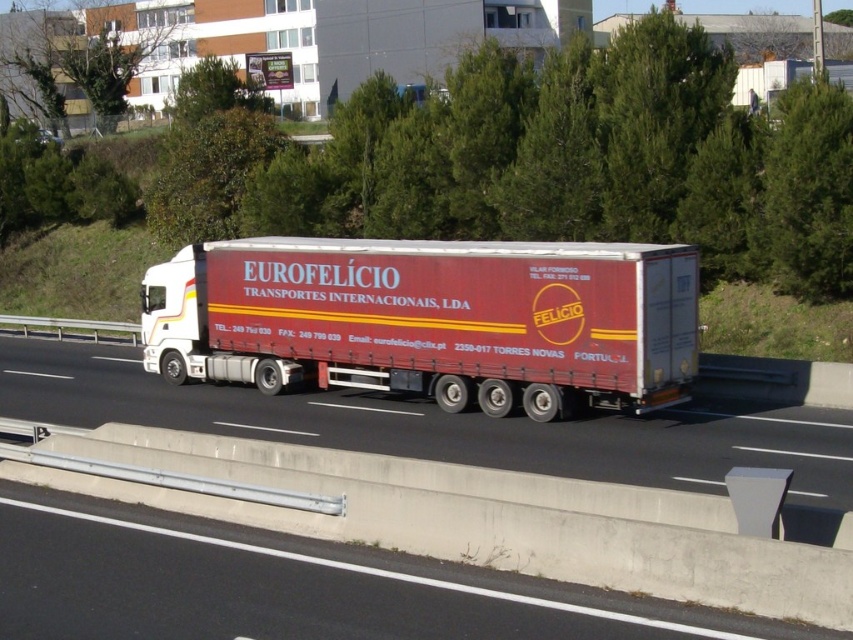
Question: Which point is closer to the camera taking this photo?

Choices:
 (A) (279, 285)
 (B) (190, 406)

Answer: (B)

Question: Which point is closer to the camera?

Choices:
 (A) [x=534, y=424]
 (B) [x=433, y=394]

Answer: (A)

Question: Which object appears closest to the camera in this image?

Choices:
 (A) matte red trailer truck at center
 (B) white glossy highway at center

Answer: (B)

Question: Is matte red trailer truck at center thinner than white glossy highway at center?

Choices:
 (A) yes
 (B) no

Answer: (A)

Question: Can you confirm if matte red trailer truck at center is positioned below white glossy highway at center?

Choices:
 (A) yes
 (B) no

Answer: (B)

Question: Does matte red trailer truck at center come behind white glossy highway at center?

Choices:
 (A) yes
 (B) no

Answer: (A)